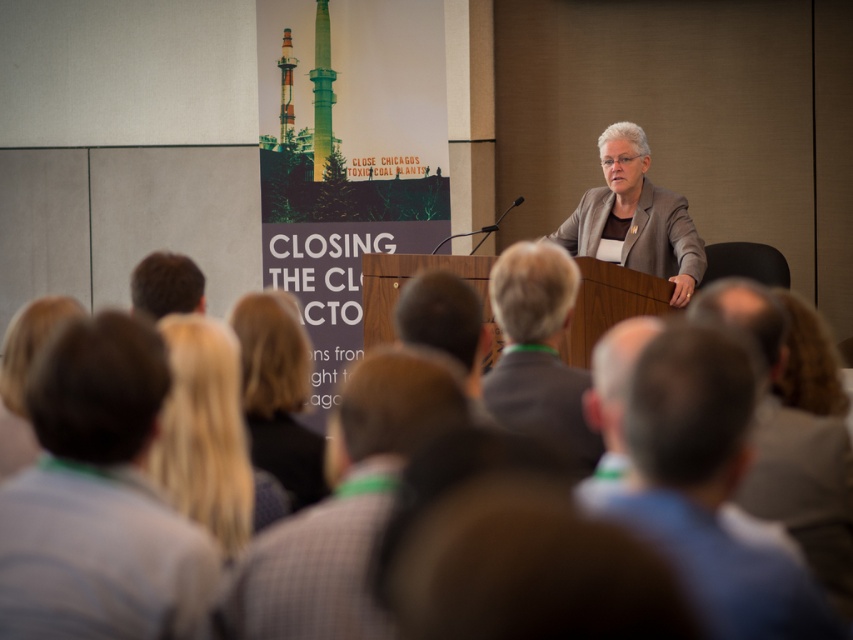
Question: Is gray fabric at lower left further to the viewer compared to brown hair at lower left?

Choices:
 (A) no
 (B) yes

Answer: (A)

Question: Which of the following is the closest to the observer?

Choices:
 (A) coord(604,168)
 (B) coord(151,301)
 (C) coord(846,502)
 (D) coord(637,330)

Answer: (D)

Question: Which point is farther to the camera?

Choices:
 (A) (654, 198)
 (B) (613, 492)
 (C) (514, 292)
 (D) (747, 316)

Answer: (A)

Question: Is gray hair at lower right below blonde hair at center?

Choices:
 (A) yes
 (B) no

Answer: (A)

Question: Does dark brown hair at center have a smaller size compared to blonde hair at lower right?

Choices:
 (A) yes
 (B) no

Answer: (B)

Question: Among these objects, which one is farthest from the camera?

Choices:
 (A) gray fabric jacket at center
 (B) gray hair at center

Answer: (A)